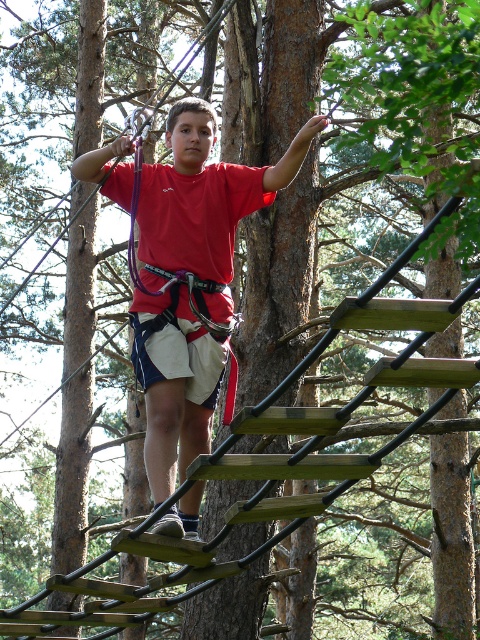
Question: Which point is farther to the camera?

Choices:
 (A) (136, 330)
 (B) (162, 179)

Answer: (B)

Question: Considering the relative positions of red matte shirt at center and white cotton shorts at center in the image provided, where is red matte shirt at center located with respect to white cotton shorts at center?

Choices:
 (A) left
 (B) right

Answer: (B)

Question: Which point is farther from the camera taking this photo?

Choices:
 (A) (180, 218)
 (B) (180, 353)

Answer: (A)

Question: Is red matte shirt at center in front of white cotton shorts at center?

Choices:
 (A) yes
 (B) no

Answer: (A)

Question: Among these objects, which one is farthest from the camera?

Choices:
 (A) red matte shirt at center
 (B) white cotton shorts at center

Answer: (B)

Question: Does red matte shirt at center appear on the left side of white cotton shorts at center?

Choices:
 (A) yes
 (B) no

Answer: (B)